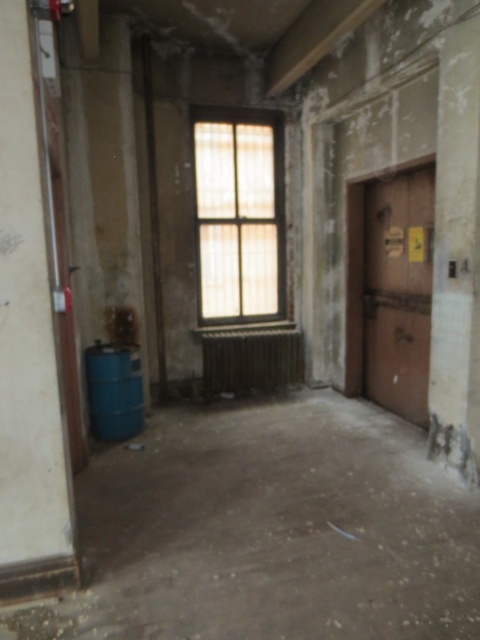
Question: Can you confirm if translucent wood window at center is positioned above wooden door at right?

Choices:
 (A) no
 (B) yes

Answer: (B)

Question: Which of the following is the farthest from the observer?

Choices:
 (A) (302, 371)
 (B) (419, 416)
 (C) (131, 364)
 (D) (225, 268)

Answer: (A)

Question: Which point appears farthest from the camera in this image?

Choices:
 (A) (279, 257)
 (B) (283, 339)
 (C) (119, 388)

Answer: (A)

Question: Is translucent wood window at center further to camera compared to wooden door at right?

Choices:
 (A) yes
 (B) no

Answer: (A)

Question: Which of these objects is positioned closest to the metallic radiator at center?

Choices:
 (A) translucent wood window at center
 (B) wooden door at right
 (C) blue matte barrel at lower left

Answer: (A)

Question: Is metallic radiator at center above blue matte barrel at lower left?

Choices:
 (A) no
 (B) yes

Answer: (B)